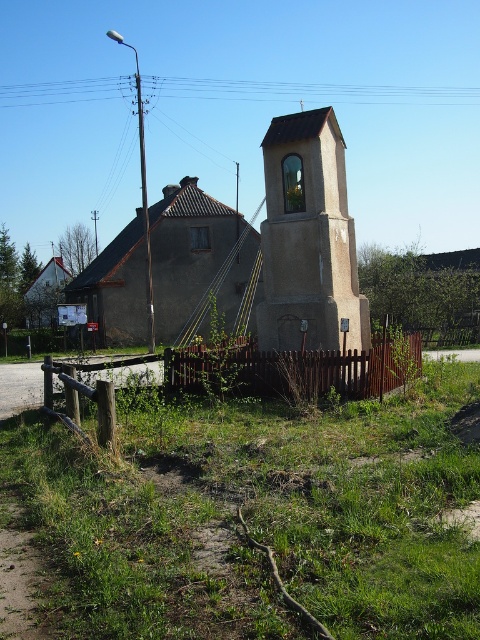
Is point (307, 116) closer to camera compared to point (192, 300)?

That is True.

Is brown concrete church at center taller than gray concrete church at center?

In fact, brown concrete church at center may be shorter than gray concrete church at center.

Is point (285, 244) closer to viewer compared to point (238, 276)?

Yes, point (285, 244) is closer to viewer.

The image size is (480, 640). In order to click on brown concrete church at center in this screenshot , I will do `click(308, 237)`.

Which is in front, point (327, 156) or point (224, 365)?

Point (224, 365) is more forward.

Identify the location of smooth concrete bell tower at center. The width and height of the screenshot is (480, 640). (309, 240).

This screenshot has width=480, height=640. What do you see at coordinates (309, 240) in the screenshot?
I see `smooth concrete bell tower at center` at bounding box center [309, 240].

Identify the location of smooth concrete bell tower at center. (309, 240).

Who is lower down, brown concrete church at center or smooth concrete bell tower at center?

smooth concrete bell tower at center

Between point (276, 131) and point (275, 237), which one is positioned behind?

The point (276, 131) is behind.

I want to click on brown concrete church at center, so click(308, 237).